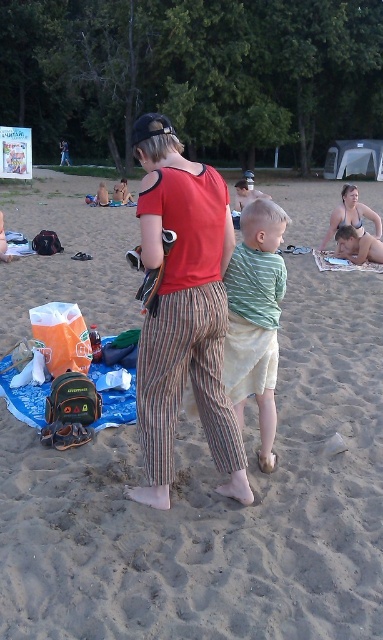
You are a photographer trying to capture a closeup shot of the matte black bikini top at upper right and the smooth tan skin at lower right. Given that your camera can only focus on objects within 30 centimeters of each other, will you be able to get both in focus?

The matte black bikini top at upper right and smooth tan skin at lower right are 32.22 centimeters apart, which exceeds the camera focus range of 30 centimeters. Therefore, you cannot get both in focus at the same time.

What are the coordinates of the sandy beach at center?

The coordinates of the sandy beach at center are at point (217,506).

You are a photographer trying to capture the scene of the sandy beach at center and the green striped shirt at center. Based on their positions, which object is closer to the camera?

The sandy beach at center is closer to the camera because it is positioned in front of the green striped shirt at center.